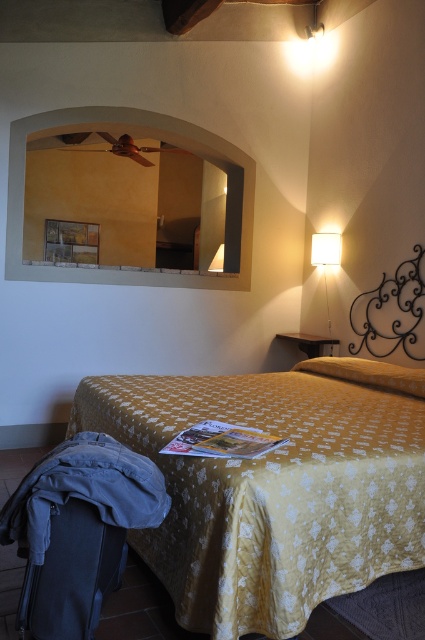
Question: Is yellow floral fabric bed at lower left wider than white fabric lampshade at upper right?

Choices:
 (A) yes
 (B) no

Answer: (A)

Question: Does matte black suitcase at lower left have a smaller size compared to white fabric lampshade at upper right?

Choices:
 (A) no
 (B) yes

Answer: (A)

Question: Observing the image, what is the correct spatial positioning of yellow fabric pillow at upper right in reference to white fabric lampshade at upper right?

Choices:
 (A) left
 (B) right

Answer: (B)

Question: Which point appears closest to the camera in this image?

Choices:
 (A) (320, 246)
 (B) (345, 371)
 (C) (337, 502)
 (D) (56, 637)

Answer: (D)

Question: Which point appears farthest from the camera in this image?

Choices:
 (A) (340, 381)
 (B) (393, 387)
 (C) (70, 547)
 (D) (314, 260)

Answer: (D)

Question: Which object is the closest to the yellow fabric pillow at upper right?

Choices:
 (A) matte black suitcase at lower left
 (B) yellow floral fabric bed at lower left
 (C) white fabric lampshade at upper right

Answer: (B)